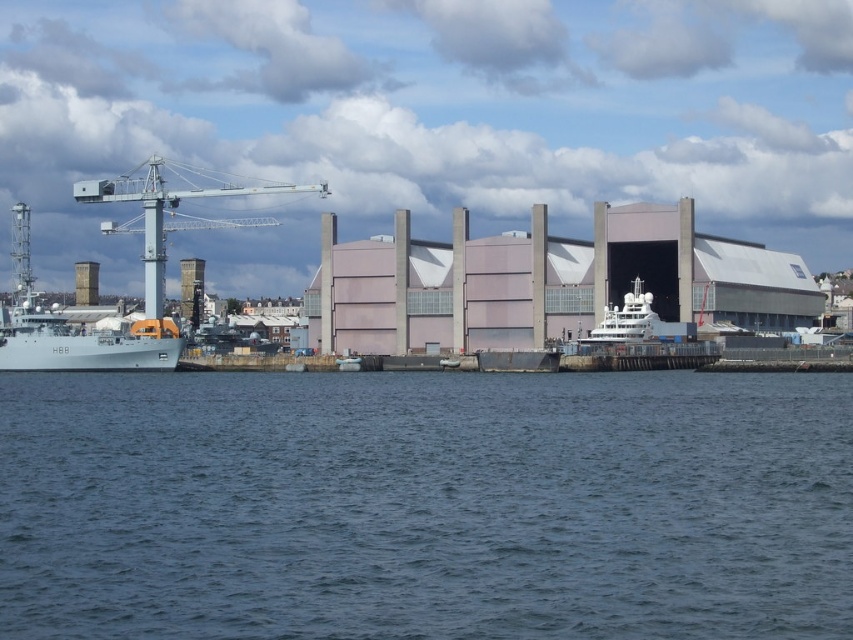
Can you confirm if blue water at lower center is positioned below gray metallic ship at left?

Yes, blue water at lower center is below gray metallic ship at left.

Does blue water at lower center appear over gray metallic ship at left?

Actually, blue water at lower center is below gray metallic ship at left.

Which is in front, point (312, 433) or point (45, 356)?

Point (312, 433)

This screenshot has height=640, width=853. Find the location of `blue water at lower center`. blue water at lower center is located at coordinates (425, 506).

Is point (552, 486) more distant than point (312, 193)?

No, (552, 486) is closer to viewer.

Is blue water at lower center to the left of metallic gray crane at upper left from the viewer's perspective?

Incorrect, blue water at lower center is not on the left side of metallic gray crane at upper left.

Is point (624, 492) closer to camera compared to point (164, 253)?

That is True.

I want to click on blue water at lower center, so click(x=425, y=506).

Does point (187, 182) lie in front of point (641, 317)?

No, (187, 182) is behind (641, 317).

Does metallic gray crane at upper left appear on the right side of shiny silver yacht at center?

In fact, metallic gray crane at upper left is to the left of shiny silver yacht at center.

Between point (102, 202) and point (573, 349), which one is positioned in front?

Positioned in front is point (573, 349).

Locate an element on the screen. The width and height of the screenshot is (853, 640). metallic gray crane at upper left is located at coordinates (167, 208).